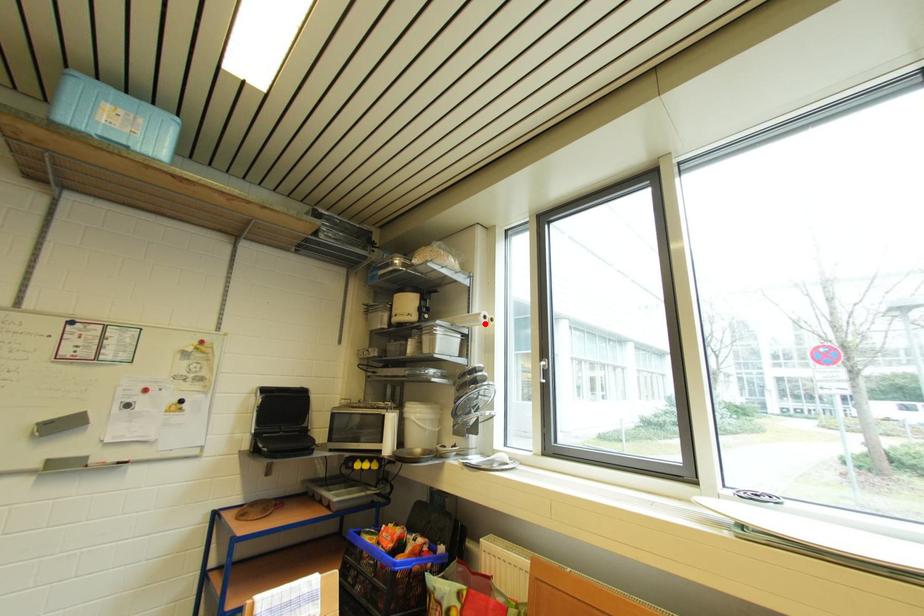
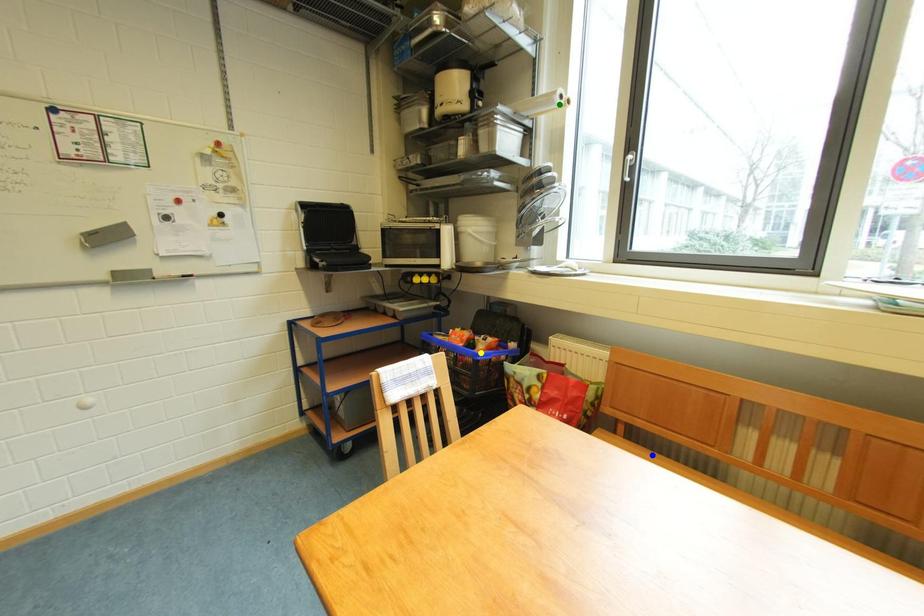
Question: I am providing you with two images of the same scene from different viewpoints. A red point is marked on the first image. You are given multiple points on the second image. Which mark in image 2 goes with the point in image 1?

Choices:
 (A) yellow point
 (B) blue point
 (C) green point

Answer: (C)